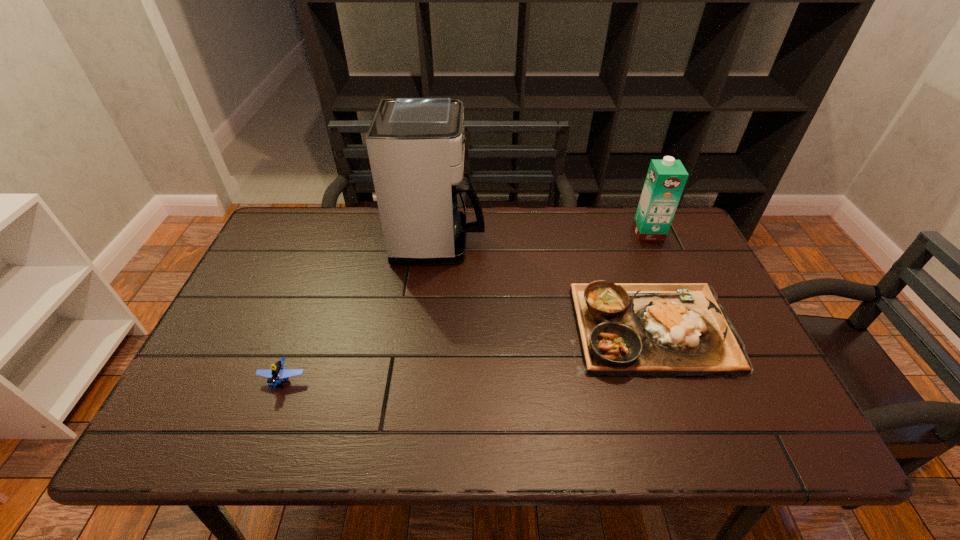
Where is `coffee maker positioned at the far edge`? coffee maker positioned at the far edge is located at coordinates (x=416, y=146).

The width and height of the screenshot is (960, 540). I want to click on carton present at the far edge, so click(665, 181).

You are a GUI agent. You are given a task and a screenshot of the screen. Output one action in this format:
    pyautogui.click(x=<x>, y=<y>)
    Task: Click on the object that is at the left edge
    The width and height of the screenshot is (960, 540).
    Given the screenshot: What is the action you would take?
    pyautogui.click(x=274, y=376)

In order to click on carton situated at the right edge in this screenshot , I will do `click(665, 181)`.

The height and width of the screenshot is (540, 960). Find the location of `platter at the right edge`. platter at the right edge is located at coordinates (663, 330).

Locate an element on the screen. The height and width of the screenshot is (540, 960). object located in the far right corner section of the desktop is located at coordinates (665, 181).

Find the location of a particular element. vacant space at the far edge of the desktop is located at coordinates (355, 240).

Identify the location of vacant region at the near edge of the desktop. (596, 435).

Find the location of a particular element. The width and height of the screenshot is (960, 540). vacant area at the left edge of the desktop is located at coordinates (268, 317).

Identify the location of vacant area between the tallest object and the carton. This screenshot has width=960, height=540. (544, 237).